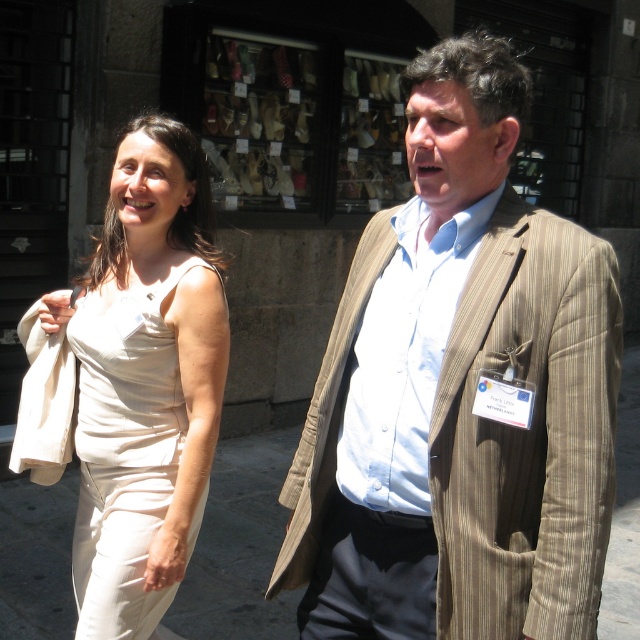
You are a tailor measuring the distance between the brown striped blazer at center and the beige fabric dress at left to decide if they can be placed on the same hanger. The hanger can hold items up to 25 inches apart. Can they be placed together?

The brown striped blazer at center and beige fabric dress at left are 23.27 inches apart, which is less than the hanger limit of 25 inches. They can be placed together.

You are a tailor observing two outfits in the shop window. The brown striped blazer at center and the beige fabric dress at left are both displayed. Which outfit is shorter in height?

The brown striped blazer at center is not as tall as the beige fabric dress at left, so the blazer is shorter in height.